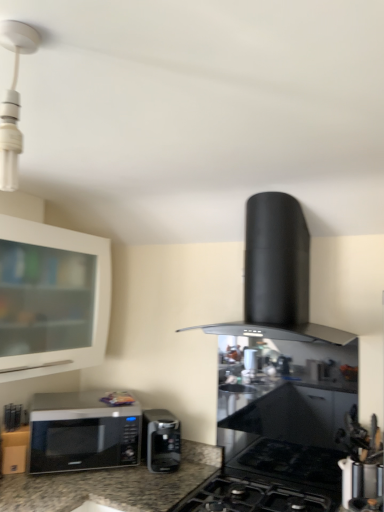
Question: Would you say black matte range hood at center is inside or outside white glossy light fixture at upper left?

Choices:
 (A) outside
 (B) inside

Answer: (A)

Question: Looking at the image, does black matte range hood at center seem bigger or smaller compared to white glossy light fixture at upper left?

Choices:
 (A) big
 (B) small

Answer: (A)

Question: Based on their relative distances, which object is farther from the black matte range hood at center?

Choices:
 (A) white glossy light fixture at upper left
 (B) satin black microwave at lower left, which appears as the first microwave oven when viewed from the right
 (C) sleek black microwave at lower left, the 1th microwave oven viewed from the left
 (D) metallic silver utensil holder at lower right
 (E) white glossy cabinet at upper left

Answer: (A)

Question: Which is nearer to the satin black microwave at lower left, which appears as the first microwave oven when viewed from the right?

Choices:
 (A) sleek black microwave at lower left, the 1th microwave oven viewed from the left
 (B) white glossy cabinet at upper left
 (C) metallic silver utensil holder at lower right
 (D) black matte gas stove at center
 (E) white glossy light fixture at upper left

Answer: (A)